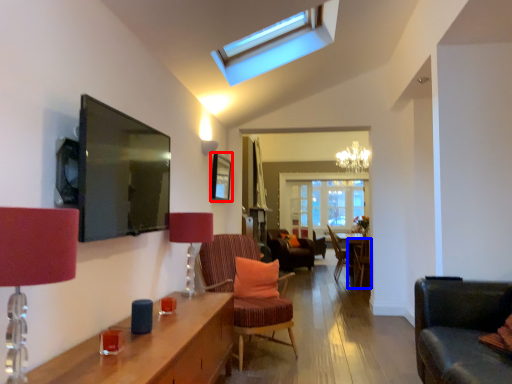
Question: Which of the following is the farthest to the observer, picture frame (highlighted by a red box) or chair (highlighted by a blue box)?

Choices:
 (A) picture frame
 (B) chair

Answer: (B)